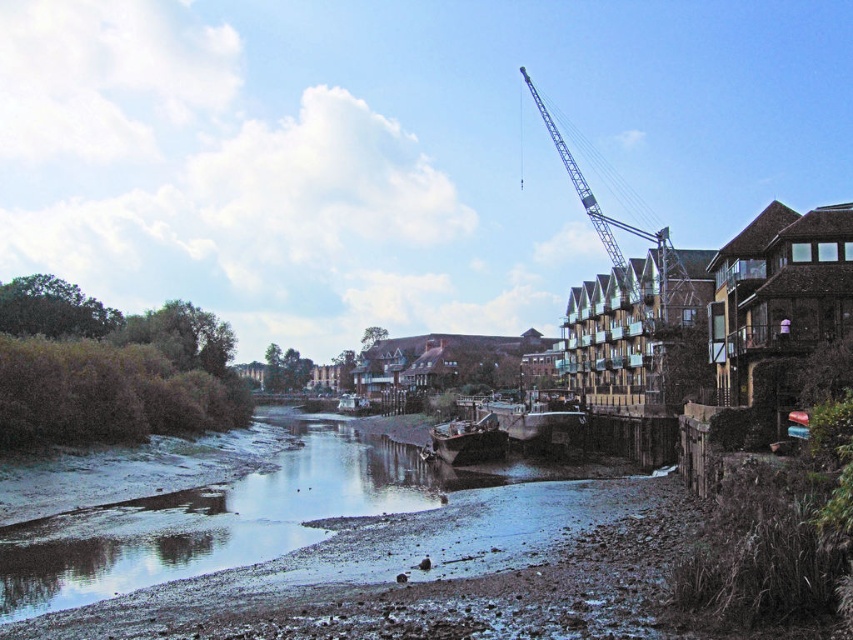
Question: Among these points, which one is farthest from the camera?

Choices:
 (A) (564, 160)
 (B) (294, 435)

Answer: (A)

Question: Among these points, which one is farthest from the camera?

Choices:
 (A) (662, 324)
 (B) (140, 531)

Answer: (A)

Question: Is smooth mud at lower center closer to the viewer compared to metallic gray crane at upper right?

Choices:
 (A) yes
 (B) no

Answer: (A)

Question: Which object appears farthest from the camera in this image?

Choices:
 (A) smooth mud at lower center
 (B) metallic gray crane at upper right

Answer: (B)

Question: Is the position of smooth mud at lower center more distant than that of metallic gray crane at upper right?

Choices:
 (A) yes
 (B) no

Answer: (B)

Question: Is smooth mud at lower center positioned at the back of metallic gray crane at upper right?

Choices:
 (A) no
 (B) yes

Answer: (A)